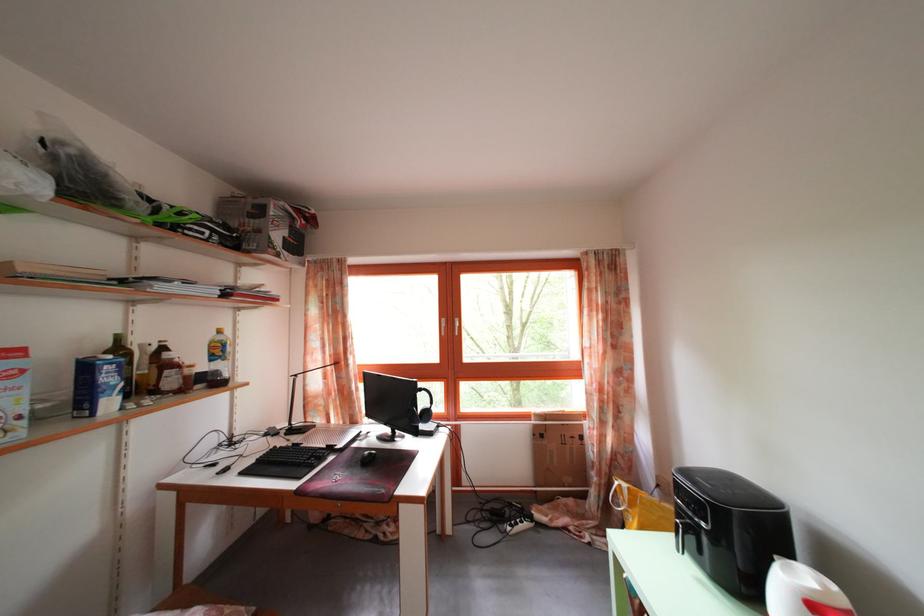
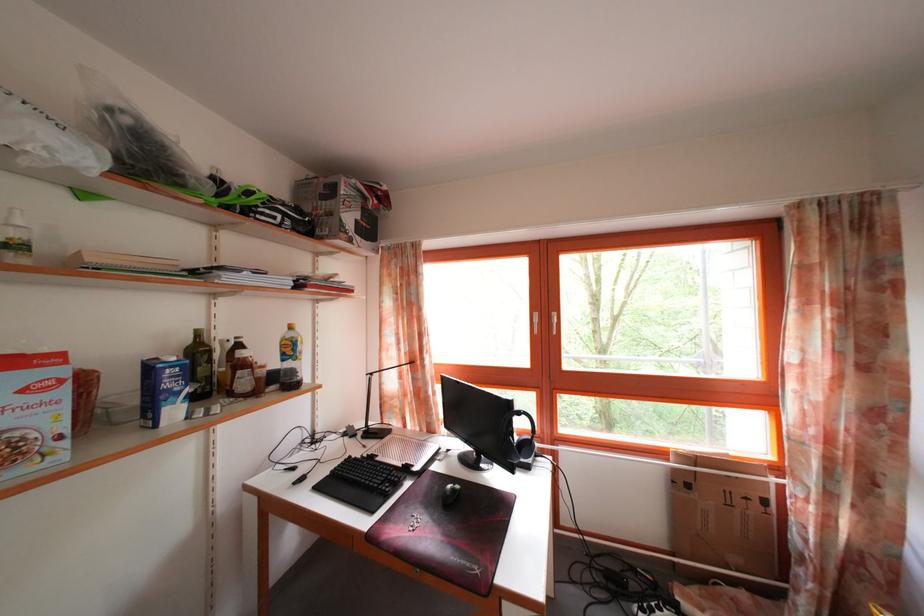
The images are taken continuously from a first-person perspective. In which direction are you moving?

The cameraman moved toward left, forward.